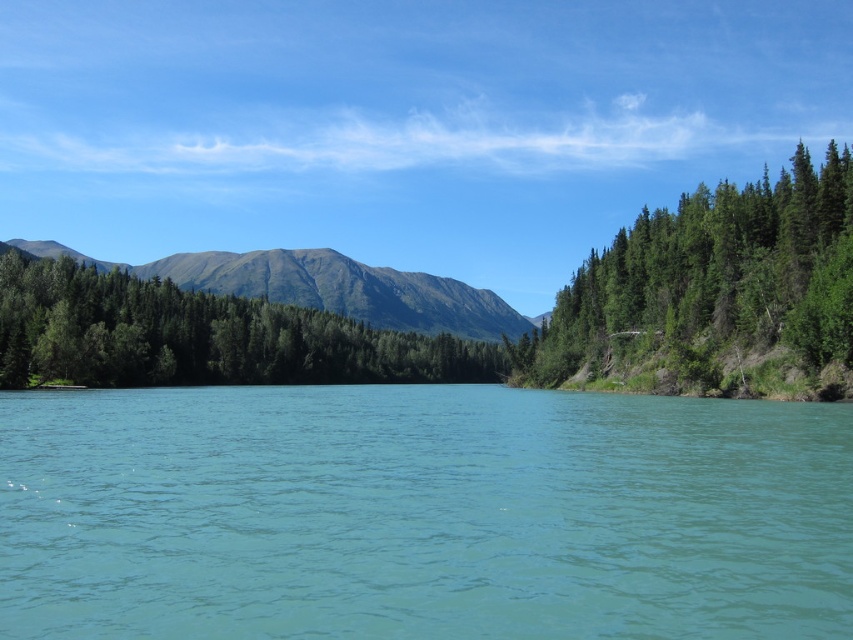
Based on the photo, you are standing at the point marked as point (502,474) in the image. You want to walk to the nearest mountain peak. How far will you have to walk?

The nearest mountain peak is 42.28 meters away from point (502,474), so you will have to walk 42.28 meters.

You are standing at the edge of the forest and want to cross to the other side of the turquoise liquid at center. The green textured trees at center are blocking your path. Which direction should you walk to go around the trees and reach the liquid?

You should walk to the right of the green textured trees at center because the turquoise liquid at center is located to the right of them, as per the description.